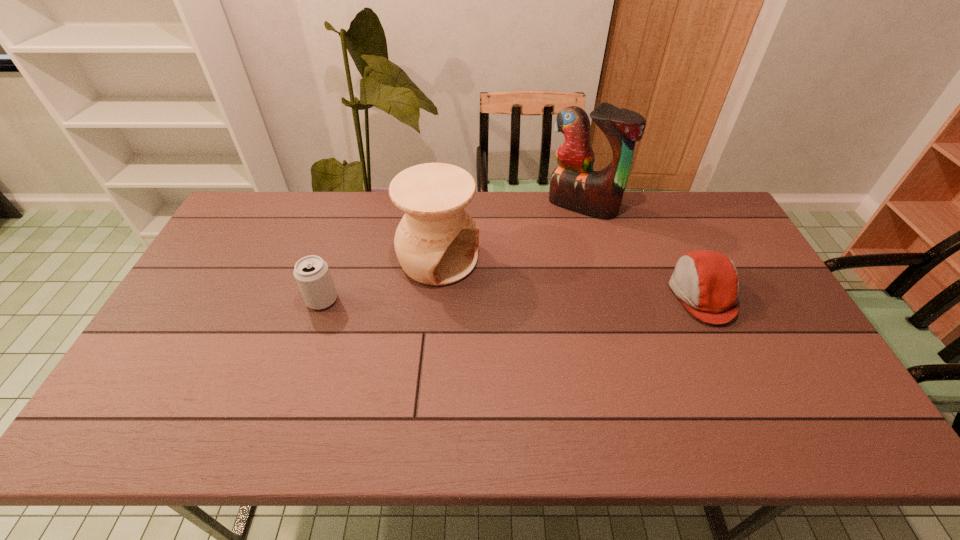
This screenshot has height=540, width=960. Find the location of `vacant space located 0.070m on the front-facing side of the cap`. vacant space located 0.070m on the front-facing side of the cap is located at coordinates (646, 294).

The width and height of the screenshot is (960, 540). I want to click on free space located 0.130m on the front-facing side of the cap, so click(x=626, y=294).

I want to click on free spot located at the open side of the pottery, so click(x=493, y=287).

You are a GUI agent. You are given a task and a screenshot of the screen. Output one action in this format:
    pyautogui.click(x=<x>, y=<y>)
    Task: Click on the vacant position located at the open side of the pottery
    This screenshot has height=540, width=960.
    Given the screenshot: What is the action you would take?
    pyautogui.click(x=584, y=333)

Identify the location of vacant space located 0.290m at the open side of the pottery. This screenshot has height=540, width=960. (557, 319).

The height and width of the screenshot is (540, 960). Identify the location of vacant space located 0.070m at the face of the tallest object. (559, 230).

In order to click on vacant area situated at the face of the tallest object in this screenshot , I will do `click(545, 247)`.

Locate an element on the screen. The width and height of the screenshot is (960, 540). free space located 0.370m at the face of the tallest object is located at coordinates (516, 285).

The width and height of the screenshot is (960, 540). I want to click on pottery present at the far edge, so click(x=436, y=242).

Locate an element on the screen. The height and width of the screenshot is (540, 960). parrot at the far edge is located at coordinates (574, 185).